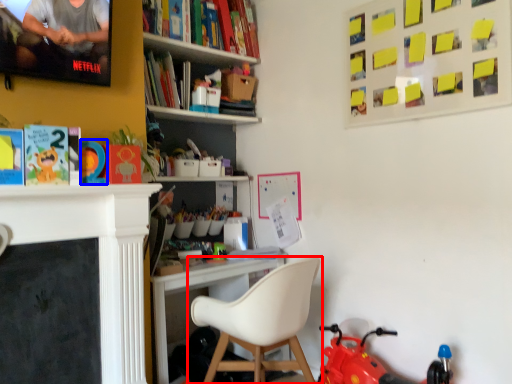
Question: Which object appears farthest to the camera in this image, chair (highlighted by a red box) or toy (highlighted by a blue box)?

Choices:
 (A) chair
 (B) toy

Answer: (B)